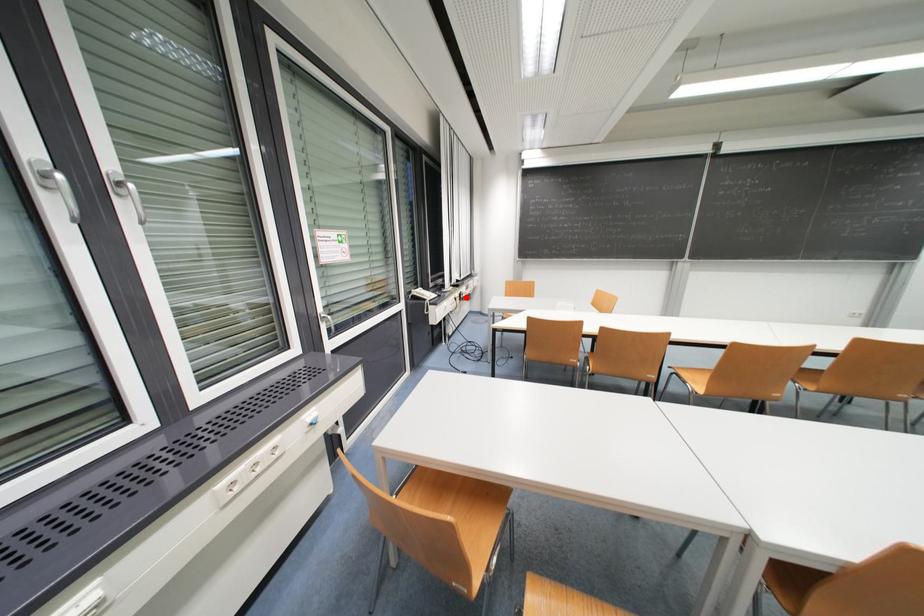
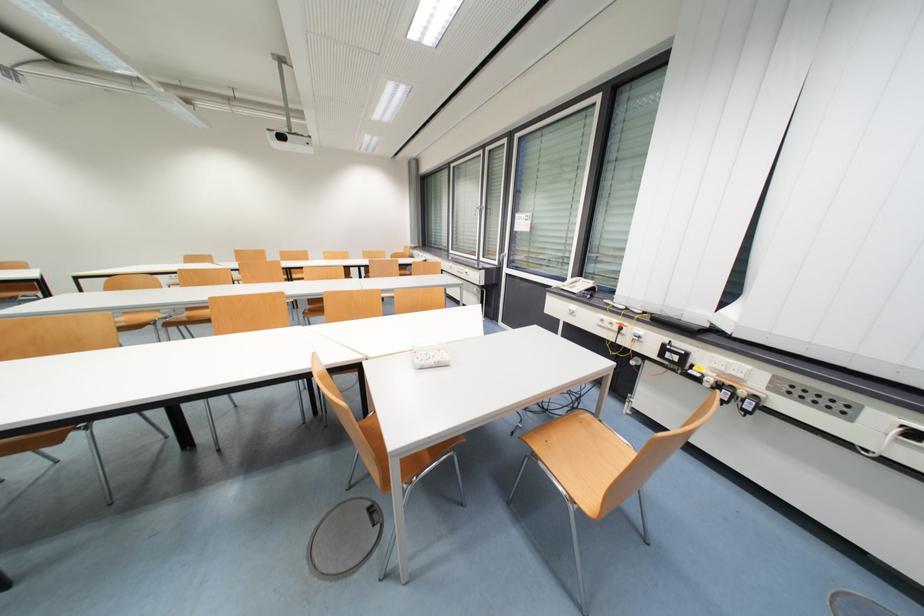
Question: I am providing you with two images of the same scene from different viewpoints. A red point is marked on the first image. Is the red point's position out of view in image 2?

Choices:
 (A) Yes
 (B) No

Answer: (B)